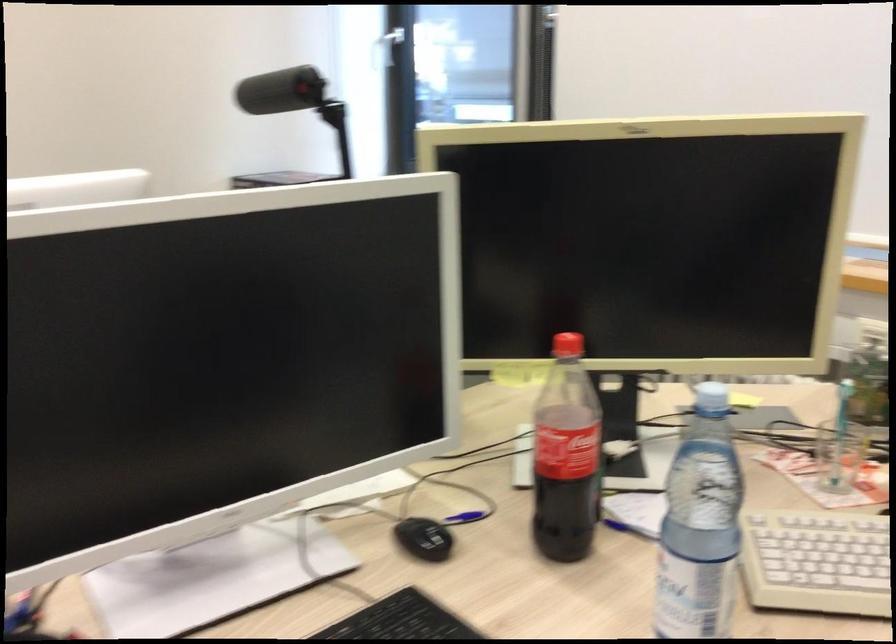
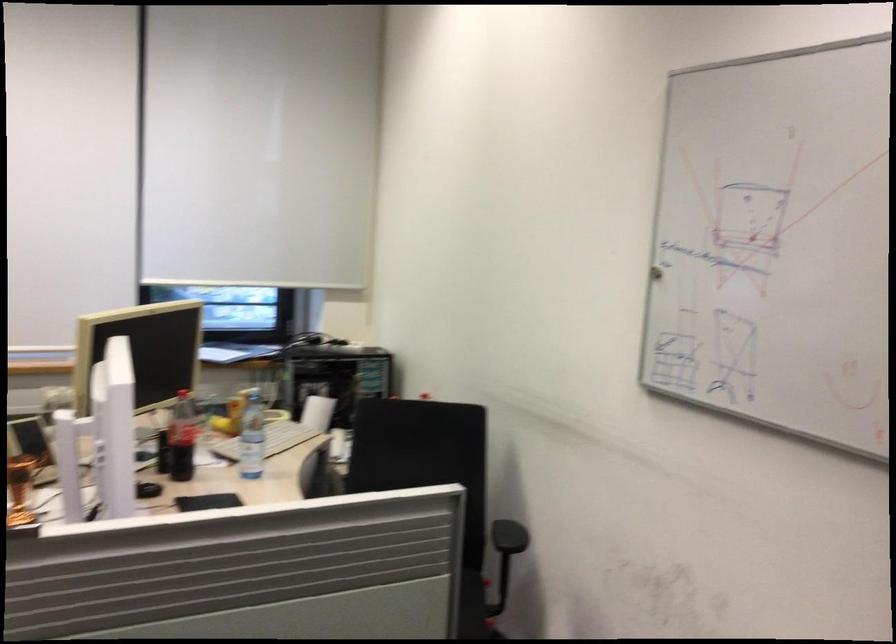
The point at (593, 471) is marked in the first image. Where is the corresponding point in the second image?

(182, 438)